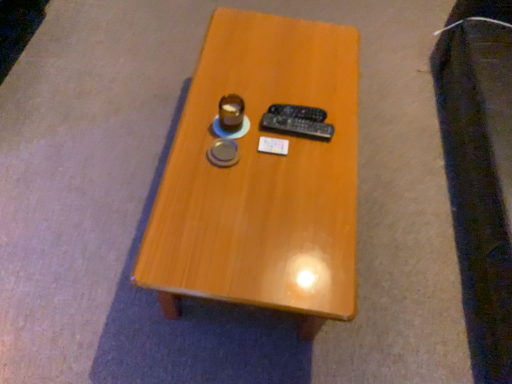
You are a GUI agent. You are given a task and a screenshot of the screen. Output one action in this format:
    pyautogui.click(x=<x>, y=<y>)
    Task: Click on the vacant space to the left of wooden table at center
    This screenshot has width=512, height=384.
    Given the screenshot: What is the action you would take?
    pyautogui.click(x=84, y=153)